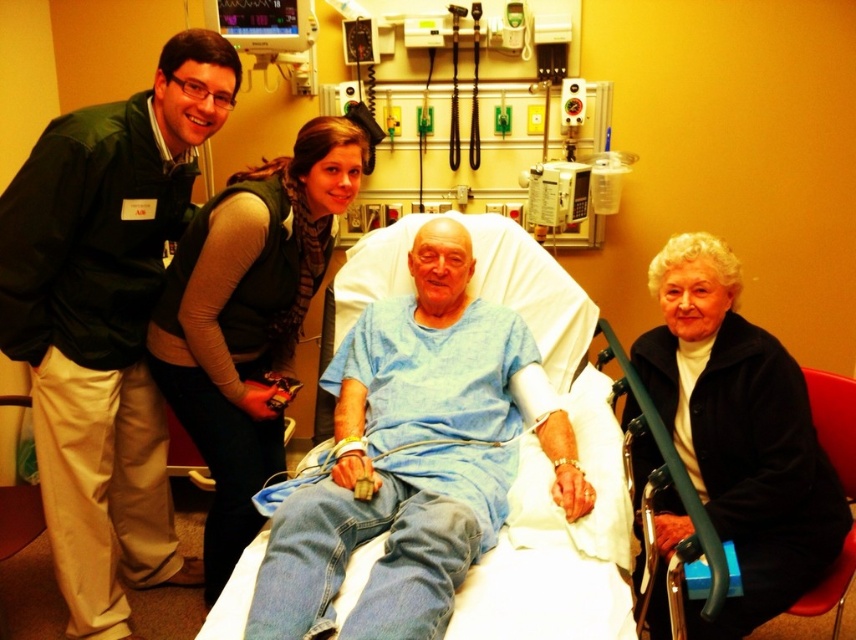
What is the color of the clothing item located at the coordinates point [406,456] in the image?

The point [406,456] indicates blue cotton shirt at center, so the color is blue.

You are a nurse in the hospital room and need to locate the green fabric vest at upper left and the blue cotton shirt at center. Which one is positioned more to the left side of the room?

The green fabric vest at upper left is positioned more to the left than the blue cotton shirt at center.